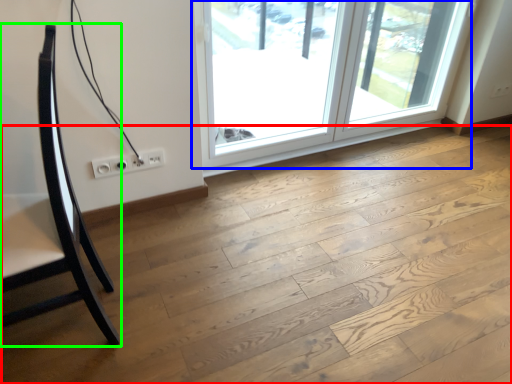
Question: Which is nearer to the plywood (highlighted by a red box)? window (highlighted by a blue box) or furniture (highlighted by a green box).

Choices:
 (A) window
 (B) furniture

Answer: (B)